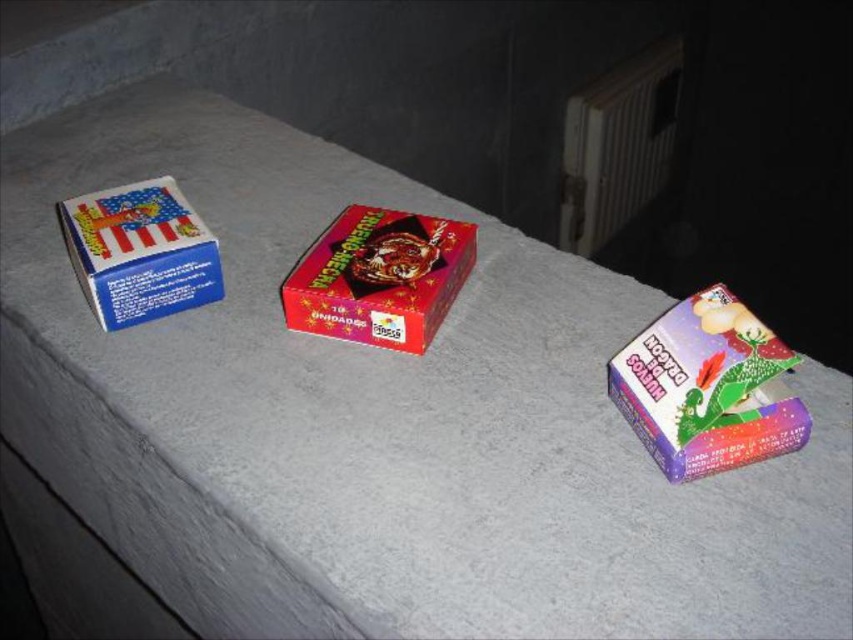
Can you confirm if shiny purple box at right is positioned to the right of blue matte matchbox at left?

Yes, shiny purple box at right is to the right of blue matte matchbox at left.

Who is taller, shiny purple box at right or blue matte matchbox at left?

Standing taller between the two is blue matte matchbox at left.

Which is behind, point (643, 404) or point (113, 241)?

The point (113, 241) is more distant.

Where is `shiny purple box at right`? The image size is (853, 640). shiny purple box at right is located at coordinates (706, 388).

Who is positioned more to the right, shiny red box at center or blue matte matchbox at left?

Positioned to the right is shiny red box at center.

Who is positioned more to the left, shiny red box at center or blue matte matchbox at left?

Positioned to the left is blue matte matchbox at left.

Which is behind, point (390, 259) or point (141, 230)?

The point (141, 230) is more distant.

Identify the location of shiny red box at center. (379, 276).

The image size is (853, 640). What do you see at coordinates (379, 276) in the screenshot?
I see `shiny red box at center` at bounding box center [379, 276].

Between point (444, 298) and point (666, 134), which one is positioned in front?

Point (444, 298)

The width and height of the screenshot is (853, 640). Find the location of `shiny red box at center`. shiny red box at center is located at coordinates (379, 276).